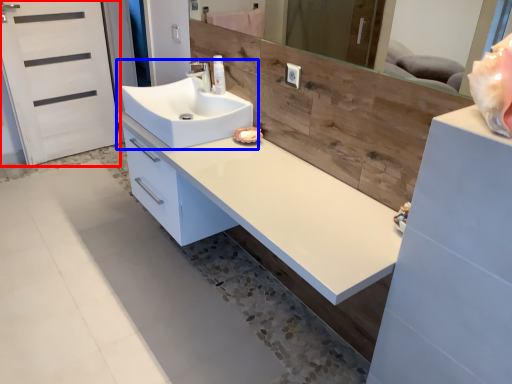
Question: Which of the following is the closest to the observer, screen door (highlighted by a red box) or sink (highlighted by a blue box)?

Choices:
 (A) screen door
 (B) sink

Answer: (B)